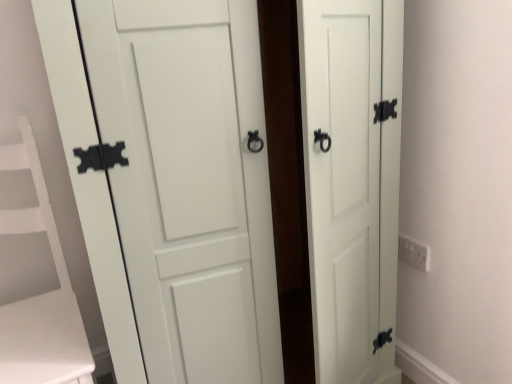
Question: Is white matte door at center taller than white plastic electric outlet at right?

Choices:
 (A) yes
 (B) no

Answer: (A)

Question: From the image's perspective, does white matte door at center appear lower than white plastic electric outlet at right?

Choices:
 (A) no
 (B) yes

Answer: (A)

Question: Can you confirm if white matte door at center is smaller than white plastic electric outlet at right?

Choices:
 (A) yes
 (B) no

Answer: (B)

Question: Can you confirm if white matte door at center is wider than white plastic electric outlet at right?

Choices:
 (A) yes
 (B) no

Answer: (A)

Question: Can you confirm if white matte door at center is thinner than white plastic electric outlet at right?

Choices:
 (A) no
 (B) yes

Answer: (A)

Question: Looking at the image, does white matte vanity at left seem bigger or smaller compared to white plastic electric outlet at right?

Choices:
 (A) big
 (B) small

Answer: (A)

Question: Considering the positions of white matte vanity at left and white plastic electric outlet at right in the image, is white matte vanity at left wider or thinner than white plastic electric outlet at right?

Choices:
 (A) wide
 (B) thin

Answer: (A)

Question: From the image's perspective, is white matte vanity at left located above or below white plastic electric outlet at right?

Choices:
 (A) above
 (B) below

Answer: (B)

Question: Do you think white matte vanity at left is within white plastic electric outlet at right, or outside of it?

Choices:
 (A) outside
 (B) inside

Answer: (A)

Question: From a real-world perspective, is white matte door at center above or below white plastic electric outlet at right?

Choices:
 (A) above
 (B) below

Answer: (A)

Question: Looking at their shapes, would you say white matte door at center is wider or thinner than white plastic electric outlet at right?

Choices:
 (A) wide
 (B) thin

Answer: (A)

Question: Would you say white matte door at center is to the left or to the right of white plastic electric outlet at right in the picture?

Choices:
 (A) left
 (B) right

Answer: (A)

Question: Is white matte door at center in front of or behind white plastic electric outlet at right in the image?

Choices:
 (A) front
 (B) behind

Answer: (A)

Question: Is white plastic electric outlet at right bigger or smaller than white matte door at center?

Choices:
 (A) small
 (B) big

Answer: (A)

Question: Is white plastic electric outlet at right inside or outside of white matte door at center?

Choices:
 (A) outside
 (B) inside

Answer: (A)